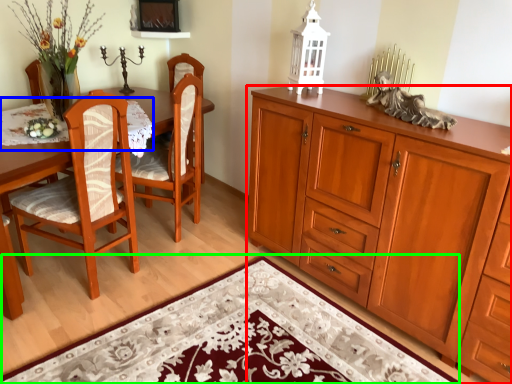
Question: Which is farther away from cabinetry (highlighted by a red box)? tablecloth (highlighted by a blue box) or doormat (highlighted by a green box)?

Choices:
 (A) tablecloth
 (B) doormat

Answer: (A)